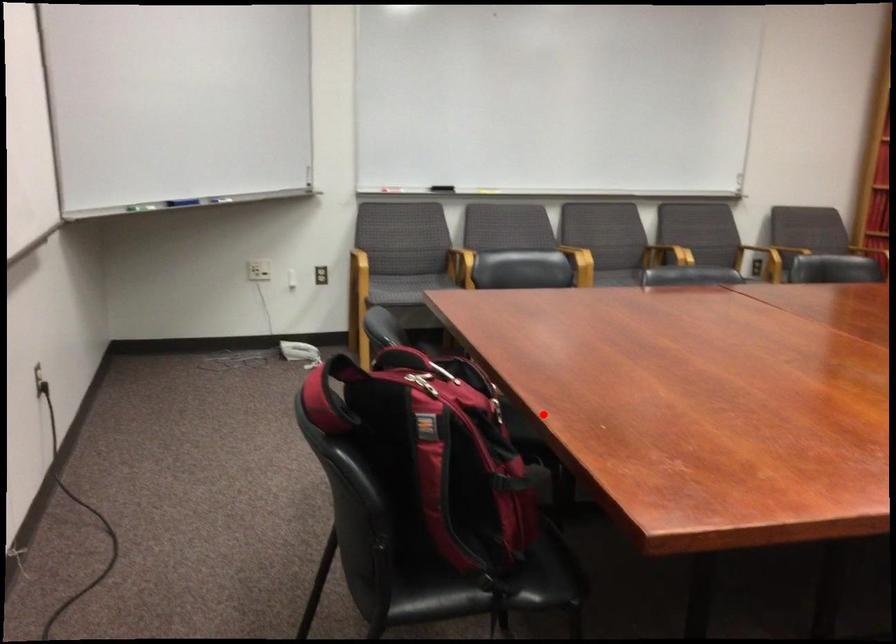
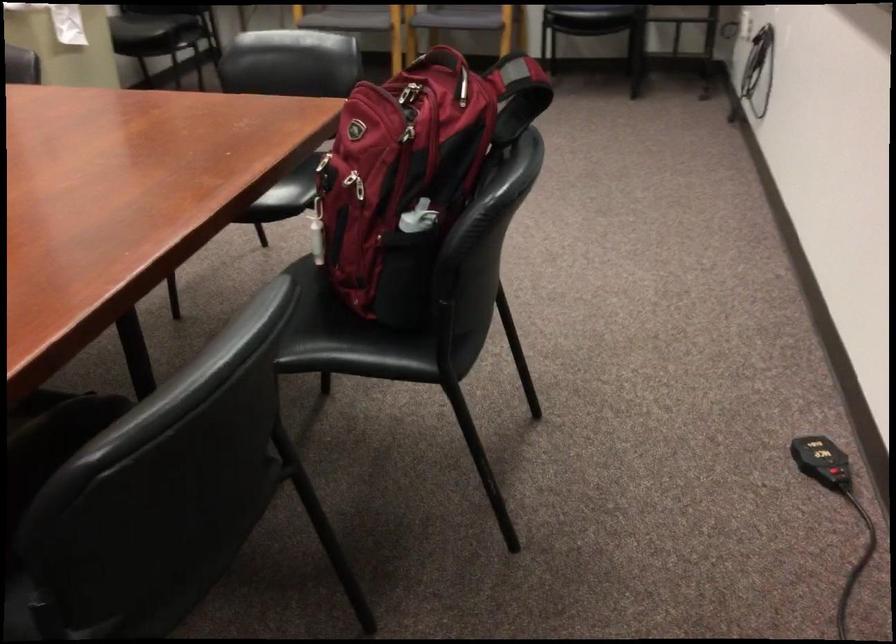
Find the pixel in the second image that matches the highlighted location in the first image.

(355, 184)